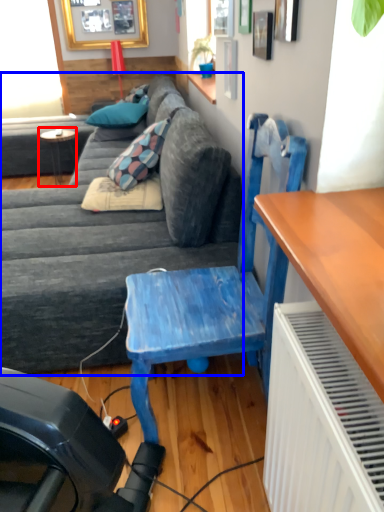
Question: Among these objects, which one is nearest to the camera, table (highlighted by a red box) or studio couch (highlighted by a blue box)?

Choices:
 (A) table
 (B) studio couch

Answer: (B)